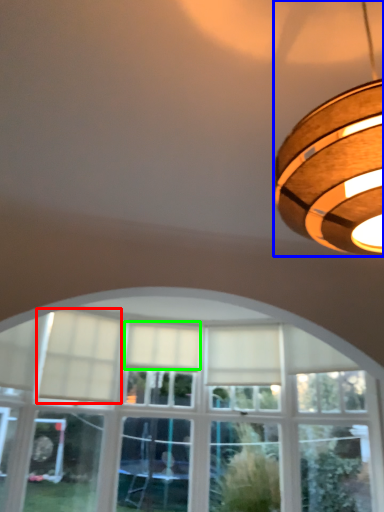
Question: Which is farther away from curtain (highlighted by a red box)? lamp (highlighted by a blue box) or curtain (highlighted by a green box)?

Choices:
 (A) lamp
 (B) curtain

Answer: (A)